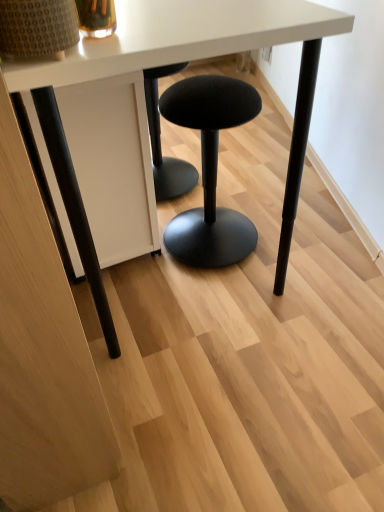
The height and width of the screenshot is (512, 384). What are the coordinates of `black fabric stool at center` in the screenshot? It's located at (180, 37).

The height and width of the screenshot is (512, 384). What do you see at coordinates (179, 37) in the screenshot?
I see `white matte table at center` at bounding box center [179, 37].

At what (x,y) coordinates should I click in order to perform the action: click on black fabric stool at center. Please return your answer as a coordinate pair (x, y). Looking at the image, I should click on (210, 170).

This screenshot has height=512, width=384. Identify the location of black fabric stool at center. (180, 37).

How different are the orientations of black fabric stool at center and white matte table at center in degrees?

The angular difference between black fabric stool at center and white matte table at center is 179 degrees.

Do you think black fabric stool at center is within white matte table at center, or outside of it?

black fabric stool at center cannot be found inside white matte table at center.

Does black fabric stool at center turn towards white matte table at center?

No, black fabric stool at center is not aimed at white matte table at center.

Can you confirm if black fabric stool at center is smaller than white matte table at center?

Indeed, black fabric stool at center has a smaller size compared to white matte table at center.

Which is farther, (211, 193) or (120, 27)?

Positioned behind is point (211, 193).

From the image's perspective, which is below, black fabric stool at center or white matte table at center?

black fabric stool at center.

From a real-world perspective, which object rests below the other?

black fabric stool at center.

How distant is black fabric stool at center from white matte table at center?

black fabric stool at center is 28.75 inches from white matte table at center.

Considering the sizes of objects white matte table at center and black fabric stool at center in the image provided, who is wider, white matte table at center or black fabric stool at center?

white matte table at center is wider.

Which point is more forward, (x=329, y=31) or (x=81, y=78)?

Point (x=81, y=78)

Is white matte table at center taller or shorter than black fabric stool at center?

Considering their sizes, white matte table at center has more height than black fabric stool at center.

Is white matte table at center facing away from black fabric stool at center?

white matte table at center is not turned away from black fabric stool at center.

From a real-world perspective, is white matte table at center under black fabric stool at center?

Actually, white matte table at center is physically above black fabric stool at center in the real world.

Does white matte table at center turn towards black fabric stool at center?

Yes, white matte table at center is oriented towards black fabric stool at center.

From the image's perspective, is white matte table at center located above or below black fabric stool at center?

From the image's perspective, white matte table at center appears above black fabric stool at center.

Considering the relative sizes of white matte table at center and black fabric stool at center in the image provided, is white matte table at center shorter than black fabric stool at center?

No.

From the image's perspective, which is below, black fabric stool at center or black fabric stool at center?

black fabric stool at center, from the image's perspective.

Which object is further away from the camera, black fabric stool at center or black fabric stool at center?

black fabric stool at center is more distant.

Is black fabric stool at center oriented towards black fabric stool at center?

No, black fabric stool at center is not facing towards black fabric stool at center.

How different are the orientations of black fabric stool at center and black fabric stool at center in degrees?

black fabric stool at center and black fabric stool at center are facing 2.97 degrees away from each other.

Is black fabric stool at center directly adjacent to black fabric stool at center?

black fabric stool at center and black fabric stool at center are clearly separated.

In the scene shown: Between black fabric stool at center and black fabric stool at center, which one has larger width?

black fabric stool at center is wider.

From the image's perspective, which one is positioned lower, black fabric stool at center or black fabric stool at center?

black fabric stool at center, from the image's perspective.

Is black fabric stool at center turned away from black fabric stool at center?

black fabric stool at center does not have its back to black fabric stool at center.

Find the location of a particular element. table above the black fabric stool at center (from the image's perspective) is located at coordinates (179, 37).

What are the coordinates of `stool that is under the white matte table at center (from a real-world perspective)` in the screenshot? It's located at (210, 170).

Considering their positions, is black fabric stool at center positioned further to white matte table at center than black fabric stool at center?

The object further to white matte table at center is black fabric stool at center.

When comparing their distances from black fabric stool at center, does black fabric stool at center or white matte table at center seem further?

Based on the image, black fabric stool at center appears to be further to black fabric stool at center.

Which object lies further to the anchor point black fabric stool at center, white matte table at center or black fabric stool at center?

black fabric stool at center is positioned further to the anchor black fabric stool at center.

Based on their spatial positions, is white matte table at center or black fabric stool at center further from black fabric stool at center?

The object further to black fabric stool at center is black fabric stool at center.

Looking at this image, estimate the real-world distances between objects in this image. Which object is further from black fabric stool at center, black fabric stool at center or white matte table at center?

Among the two, black fabric stool at center is located further to black fabric stool at center.

Estimate the real-world distances between objects in this image. Which object is closer to white matte table at center, black fabric stool at center or black fabric stool at center?

Among the two, black fabric stool at center is located nearer to white matte table at center.

Identify the location of table between black fabric stool at center and black fabric stool at center from front to back. (179, 37).